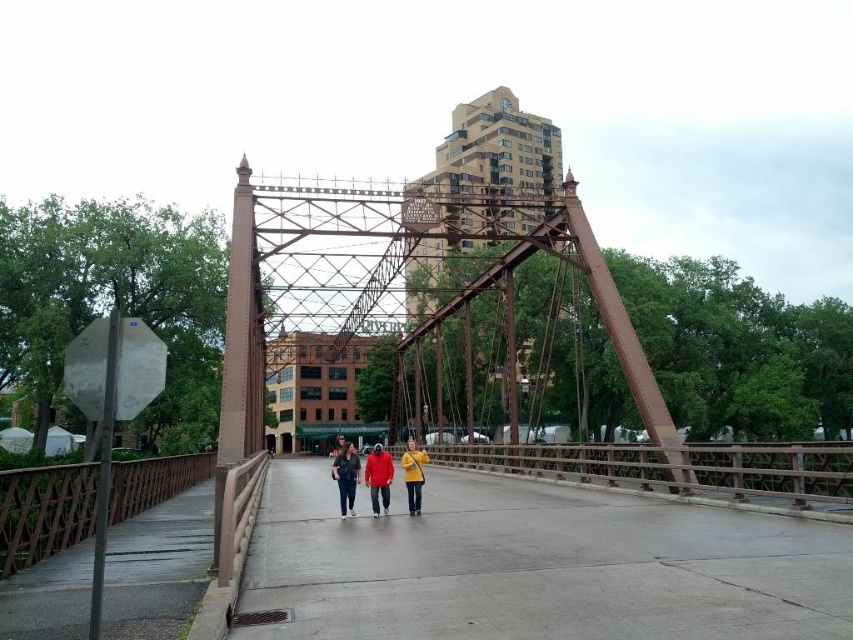
Measure the distance between point [370,497] and camera.

They are 89.00 feet apart.

Can you confirm if red matte jacket at center is thinner than matte yellow jacket at center?

No, red matte jacket at center is not thinner than matte yellow jacket at center.

Does point (384, 467) come in front of point (415, 477)?

Yes, point (384, 467) is in front of point (415, 477).

Identify the location of red matte jacket at center. (378, 477).

Who is positioned more to the left, gray concrete pavement at center or matte yellow jacket at center?

From the viewer's perspective, matte yellow jacket at center appears more on the left side.

Between gray concrete pavement at center and matte yellow jacket at center, which one has less height?

gray concrete pavement at center is shorter.

Between point (601, 568) and point (405, 467), which one is positioned behind?

Point (405, 467)

In order to click on gray concrete pavement at center in this screenshot , I will do `click(535, 564)`.

Does gray concrete pavement at center come behind matte red jacket at center?

That is False.

Is gray concrete pavement at center to the left of matte red jacket at center from the viewer's perspective?

In fact, gray concrete pavement at center is to the right of matte red jacket at center.

Who is more distant from viewer, (467, 486) or (347, 476)?

→ Positioned behind is point (467, 486).

The image size is (853, 640). Find the location of `gray concrete pavement at center`. gray concrete pavement at center is located at coordinates (535, 564).